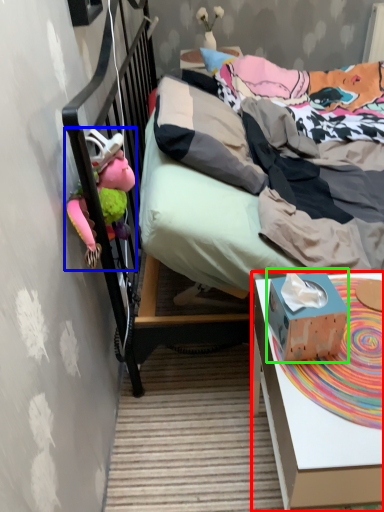
Question: Considering the real-world distances, which object is farthest from desk (highlighted by a red box)? toy (highlighted by a blue box) or box (highlighted by a green box)?

Choices:
 (A) toy
 (B) box

Answer: (A)